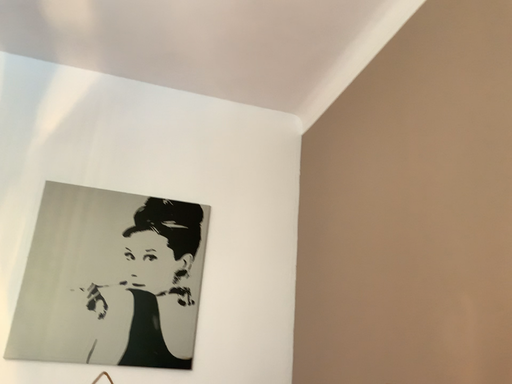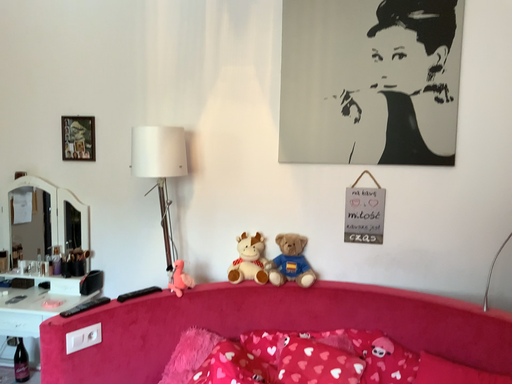
Question: How did the camera likely rotate when shooting the video?

Choices:
 (A) rotated downward
 (B) rotated upward

Answer: (A)